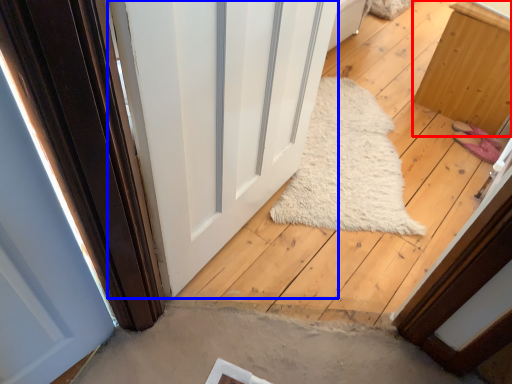
Question: Which object is closer to the camera taking this photo, furniture (highlighted by a red box) or door (highlighted by a blue box)?

Choices:
 (A) furniture
 (B) door

Answer: (B)